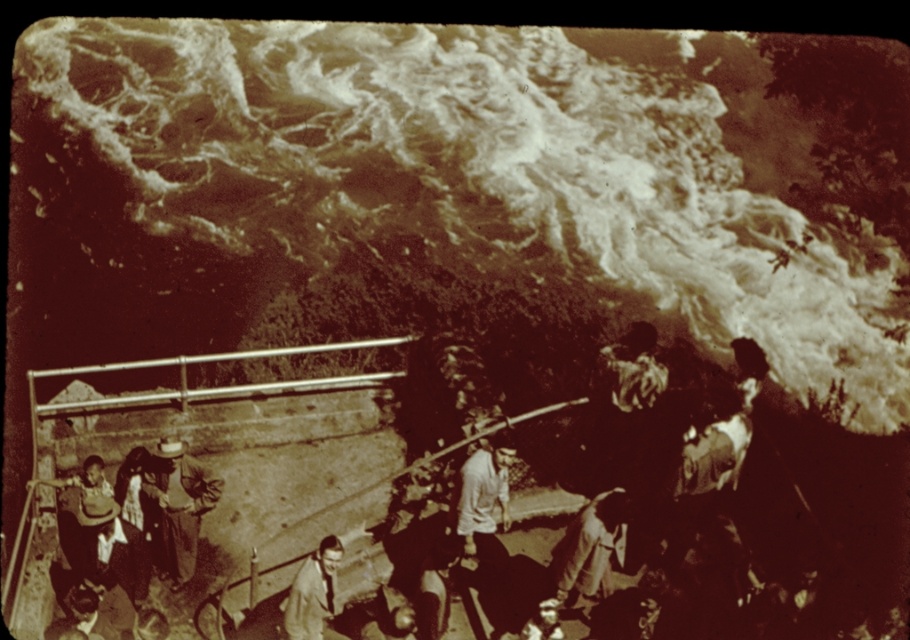
Which is above, light brown fabric shirt at center or light brown leather jacket at lower center?

light brown fabric shirt at center

Who is positioned more to the left, light brown fabric shirt at center or light brown leather jacket at lower center?

From the viewer's perspective, light brown leather jacket at lower center appears more on the left side.

Is point (471, 468) behind point (326, 570)?

Yes, it is behind point (326, 570).

Where is `light brown fabric shirt at center`? The image size is (910, 640). light brown fabric shirt at center is located at coordinates point(484,497).